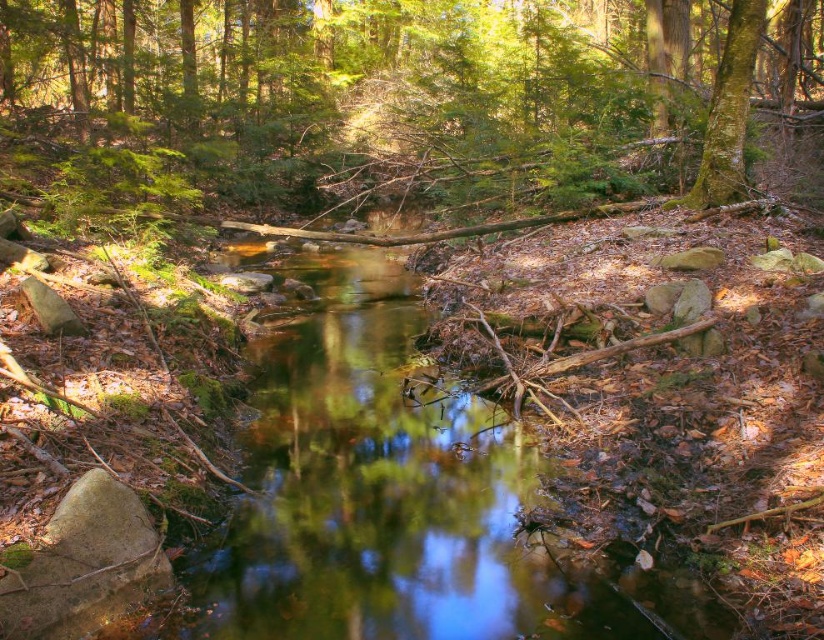
You are an environmental scientist studying tree growth patterns in this forest. You observe the green matte tree at center and the green mossy tree at upper right. Which tree has a wider trunk?

The green matte tree at center has a wider trunk than the green mossy tree at upper right.

You are standing at the edge of the forest stream and notice a point marked at coordinates (x=406, y=99). What object is located at that point?

The point at (x=406, y=99) indicates a green matte tree at center.